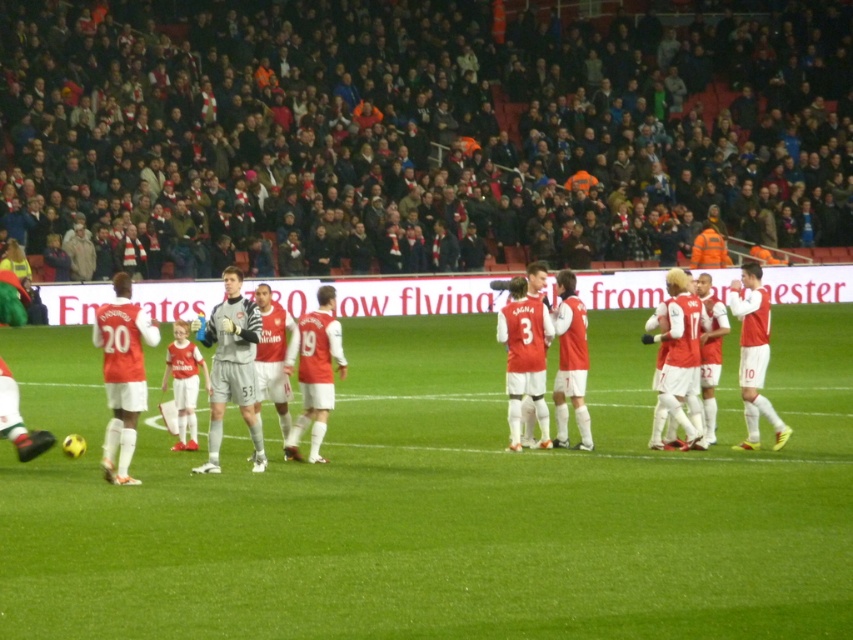
You are a drone operator tasked with capturing aerial footage of the soccer match. Your camera has a maximum zoom range of 20 meters. You need to focus on the dark gray fabric crowd at upper center and the matte red jersey at right. Can your camera zoom in clearly on both subjects simultaneously?

The distance between the dark gray fabric crowd at upper center and the matte red jersey at right is 25.11 meters, which exceeds the camera maximum zoom range of 20 meters. Therefore, the camera cannot zoom in clearly on both subjects simultaneously.

You are a soccer player positioned at point (33, 195) and need to pass the ball to your teammate at point (239, 396). Considering the positions of the players in the scene, which direction should you pass the ball to reach your teammate?

The point (33, 195) is behind point (239, 396), so you should pass the ball forward towards the direction of point (239, 396) to reach your teammate.